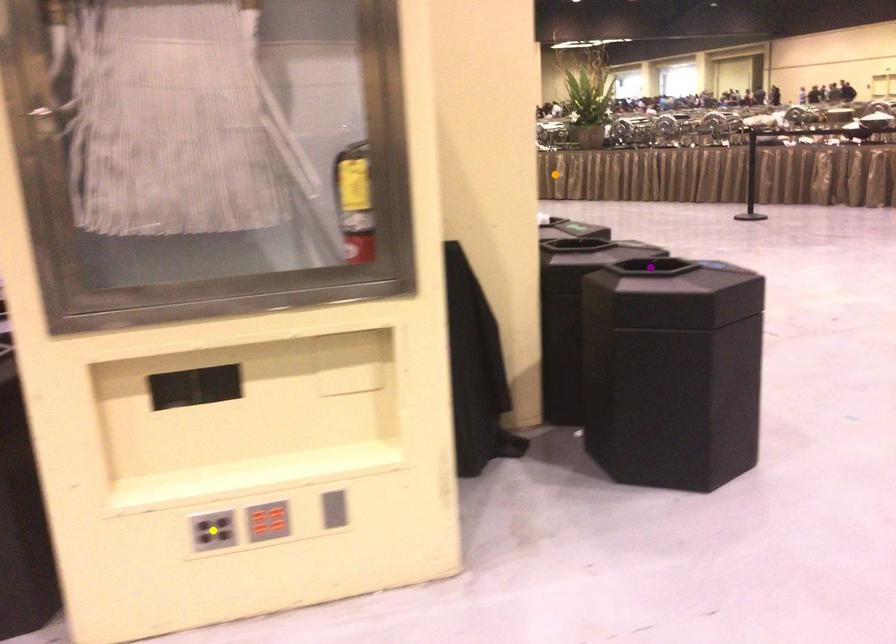
Order these from nearest to farthest:
yellow point | orange point | purple point

yellow point
purple point
orange point